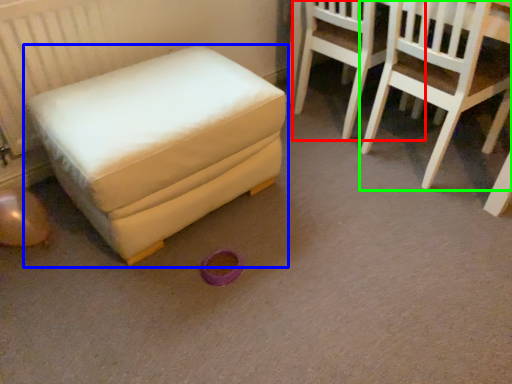
Question: Which object is positioned farthest from chair (highlighted by a red box)? Select from furniture (highlighted by a blue box) and chair (highlighted by a green box).

Choices:
 (A) furniture
 (B) chair

Answer: (A)